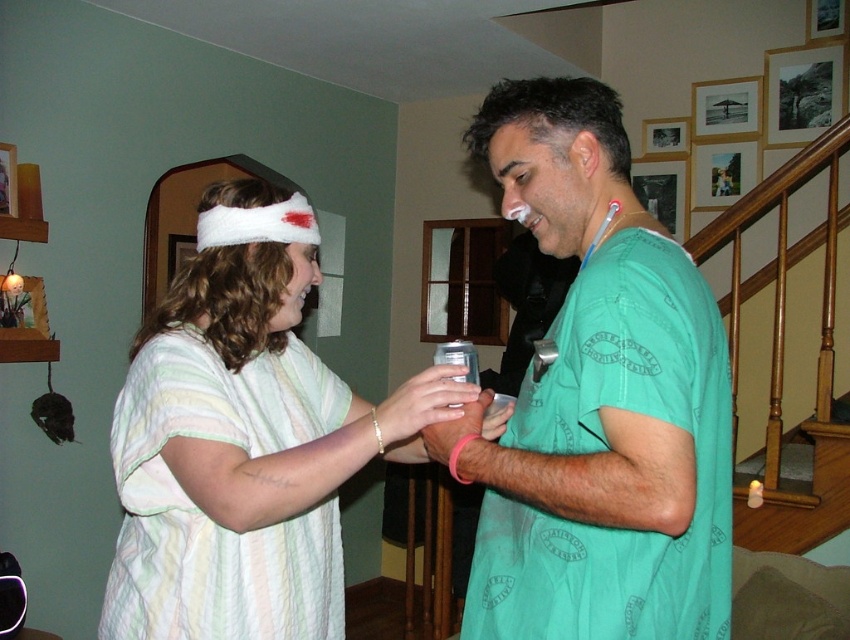
You are designing a costume for a character in a video game. The costume must include both the green fabric shirt at center and the white fluffy headband at upper left. If the headband needs to be visible over the shirt, which item should be placed higher on the character?

The white fluffy headband at upper left should be placed higher than the green fabric shirt at center because the headband is wider than the shirt, ensuring visibility.

You are standing in the room and want to hand a gift to the person wearing the green fabric shirt at center. To do so, should you walk towards the left or the right of the white fluffy headband at upper left?

The green fabric shirt at center is to the right of the white fluffy headband at upper left, so you should walk towards the right of the white fluffy headband at upper left to reach the person wearing the green fabric shirt at center.